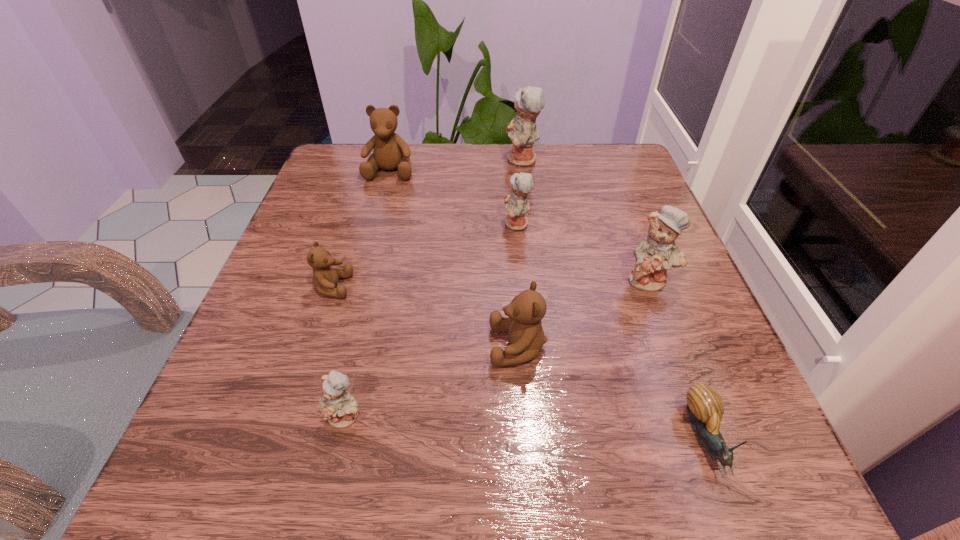
You are a GUI agent. You are given a task and a screenshot of the screen. Output one action in this format:
    pyautogui.click(x=<x>, y=<y>)
    Task: Click on the vacant space at the far edge of the desktop
    The width and height of the screenshot is (960, 540).
    Given the screenshot: What is the action you would take?
    pyautogui.click(x=471, y=176)

What are the coordinates of `free space at the near edge of the desktop` in the screenshot? It's located at [x=439, y=463].

The width and height of the screenshot is (960, 540). In the image, there is a desktop. In order to click on vacant space at the left edge in this screenshot , I will do `click(308, 293)`.

In the image, there is a desktop. Where is `vacant space at the right edge`? This screenshot has height=540, width=960. vacant space at the right edge is located at coordinates (612, 213).

Identify the location of free point at the far left corner. The height and width of the screenshot is (540, 960). (348, 157).

The width and height of the screenshot is (960, 540). In the image, there is a desktop. What are the coordinates of `vacant space at the near left corner` in the screenshot? It's located at (214, 508).

The width and height of the screenshot is (960, 540). Identify the location of unoccupied position between the shortest object and the third nearest object. (x=612, y=392).

I want to click on vacant space that's between the tallest teddy bear and the second nearest brown teddy bear, so click(427, 224).

The width and height of the screenshot is (960, 540). Find the location of `vacant area that lies between the leftmost blue teddy bear and the second farthest brown teddy bear`. vacant area that lies between the leftmost blue teddy bear and the second farthest brown teddy bear is located at coordinates (339, 352).

Image resolution: width=960 pixels, height=540 pixels. Find the location of `free space between the nearest teddy bear and the shortest object`. free space between the nearest teddy bear and the shortest object is located at coordinates (x=526, y=427).